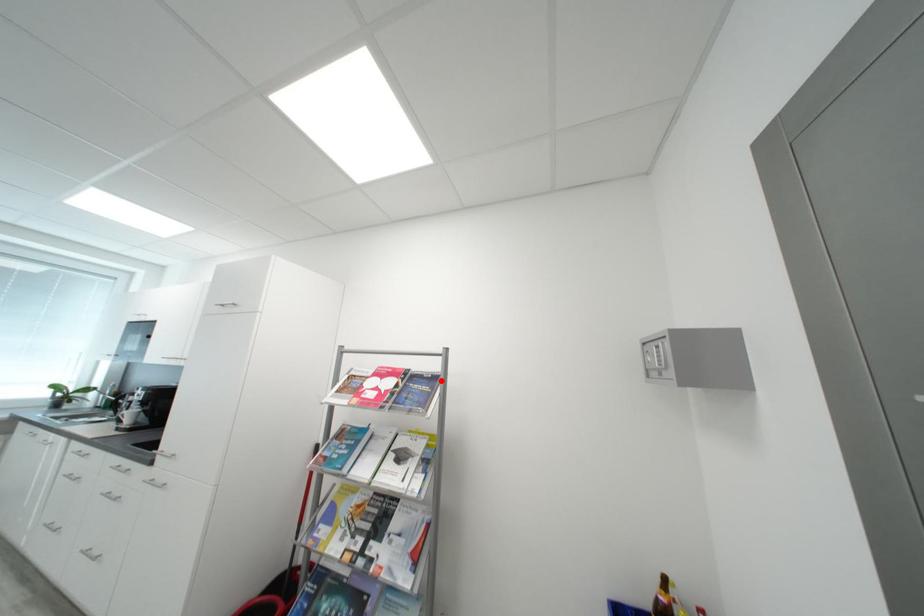
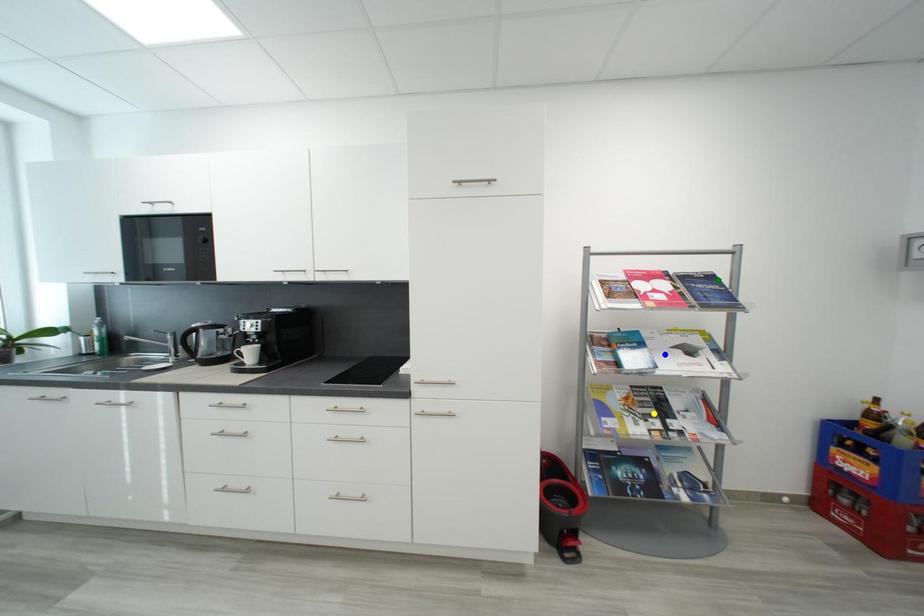
Question: I am providing you with two images of the same scene from different viewpoints. A red point is marked on the first image. You are given multiple points on the second image. Which spot in image 2 lines up with the point in image 1?

Choices:
 (A) yellow point
 (B) blue point
 (C) green point

Answer: (C)